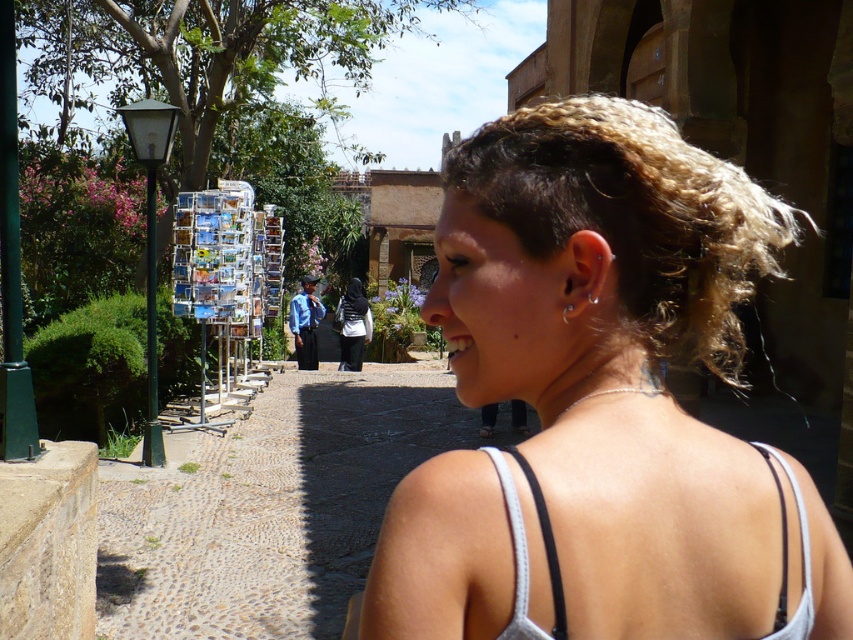
You are a photographer trying to capture a shot of the blonde hair at upper right and the black fabric hijab at center. Based on their positions, which one is located to the right side of the other?

The blonde hair at upper right is located to the right of the black fabric hijab at center.